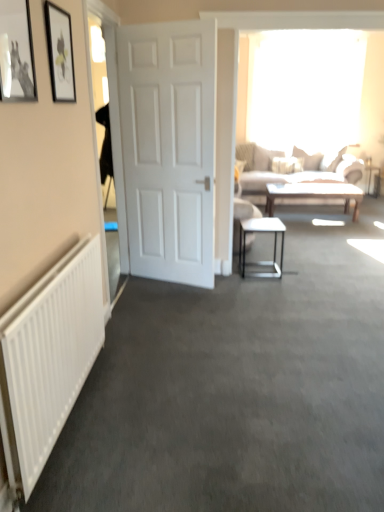
Question: Considering the relative sizes of metallic silver picture frame at upper left, the 2th picture frame positioned from the back, and light beige fabric couch at upper right in the image provided, is metallic silver picture frame at upper left, the 2th picture frame positioned from the back, bigger than light beige fabric couch at upper right?

Choices:
 (A) yes
 (B) no

Answer: (B)

Question: Can we say metallic silver picture frame at upper left, the 2th picture frame positioned from the back, lies outside light beige fabric couch at upper right?

Choices:
 (A) yes
 (B) no

Answer: (A)

Question: Does metallic silver picture frame at upper left, which is the 1th picture frame from front to back, have a lesser height compared to light beige fabric couch at upper right?

Choices:
 (A) yes
 (B) no

Answer: (A)

Question: Considering the relative positions of metallic silver picture frame at upper left, the 2th picture frame positioned from the back, and light beige fabric couch at upper right in the image provided, is metallic silver picture frame at upper left, the 2th picture frame positioned from the back, behind light beige fabric couch at upper right?

Choices:
 (A) no
 (B) yes

Answer: (A)

Question: Is metallic silver picture frame at upper left, the 2th picture frame positioned from the back, oriented towards light beige fabric couch at upper right?

Choices:
 (A) no
 (B) yes

Answer: (A)

Question: From the image's perspective, is white matte door at center above or below white glossy door at left?

Choices:
 (A) below
 (B) above

Answer: (B)

Question: Is white matte door at center inside the boundaries of white glossy door at left, or outside?

Choices:
 (A) inside
 (B) outside

Answer: (B)

Question: Is white matte door at center taller or shorter than white glossy door at left?

Choices:
 (A) short
 (B) tall

Answer: (A)

Question: Is point (167, 260) closer or farther from the camera than point (122, 217)?

Choices:
 (A) closer
 (B) farther

Answer: (A)

Question: Is white matte door at center bigger or smaller than metallic silver picture frame at upper left, the 2th picture frame positioned from the back?

Choices:
 (A) small
 (B) big

Answer: (B)

Question: Based on their positions, is white matte door at center located to the left or right of metallic silver picture frame at upper left, which is the 1th picture frame from front to back?

Choices:
 (A) left
 (B) right

Answer: (B)

Question: From the image's perspective, relative to metallic silver picture frame at upper left, the 2th picture frame positioned from the back, is white matte door at center above or below?

Choices:
 (A) below
 (B) above

Answer: (A)

Question: Is white matte door at center taller or shorter than metallic silver picture frame at upper left, the 2th picture frame positioned from the back?

Choices:
 (A) tall
 (B) short

Answer: (A)

Question: Considering the positions of white glossy door at left and light brown wooden coffee table at center in the image, is white glossy door at left taller or shorter than light brown wooden coffee table at center?

Choices:
 (A) tall
 (B) short

Answer: (A)

Question: From a real-world perspective, relative to light brown wooden coffee table at center, is white glossy door at left vertically above or below?

Choices:
 (A) above
 (B) below

Answer: (A)